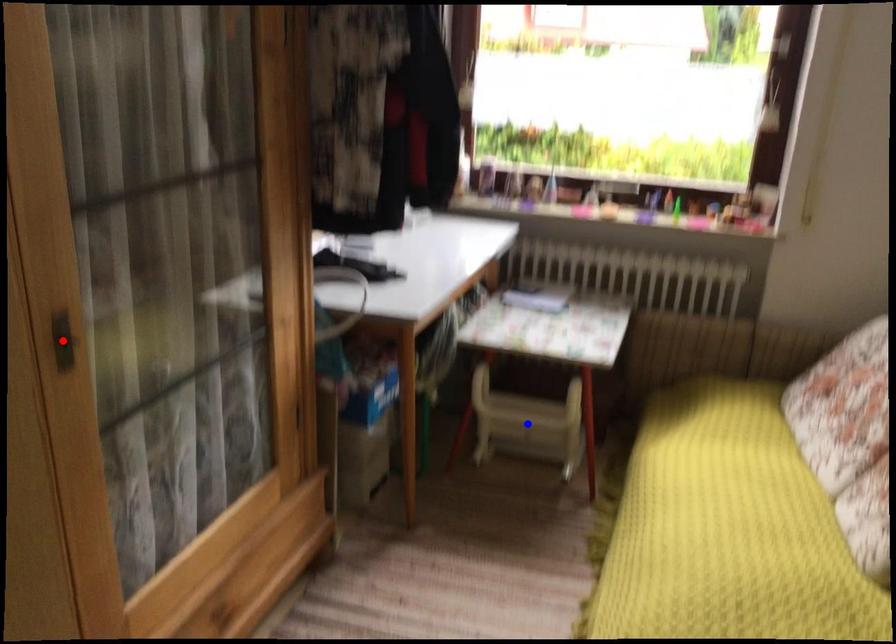
Question: Which of the two points in the image is closer to the camera?

Choices:
 (A) Blue point is closer.
 (B) Red point is closer.

Answer: (B)